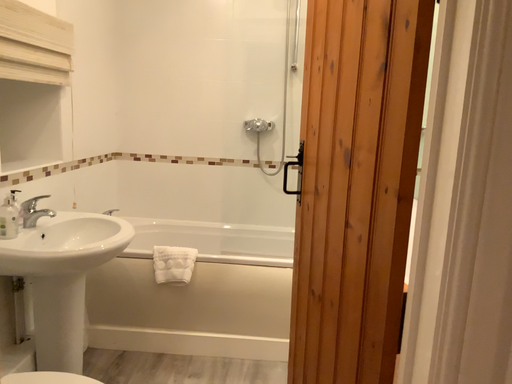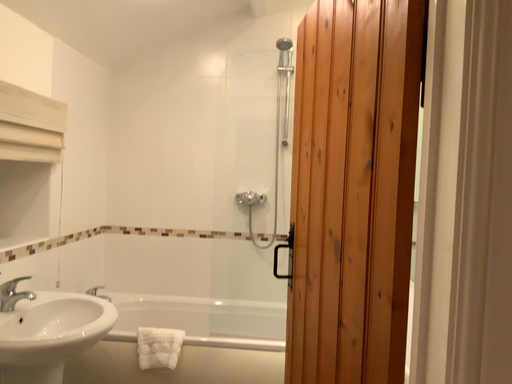
Question: How did the camera likely rotate when shooting the video?

Choices:
 (A) rotated upward
 (B) rotated downward

Answer: (A)